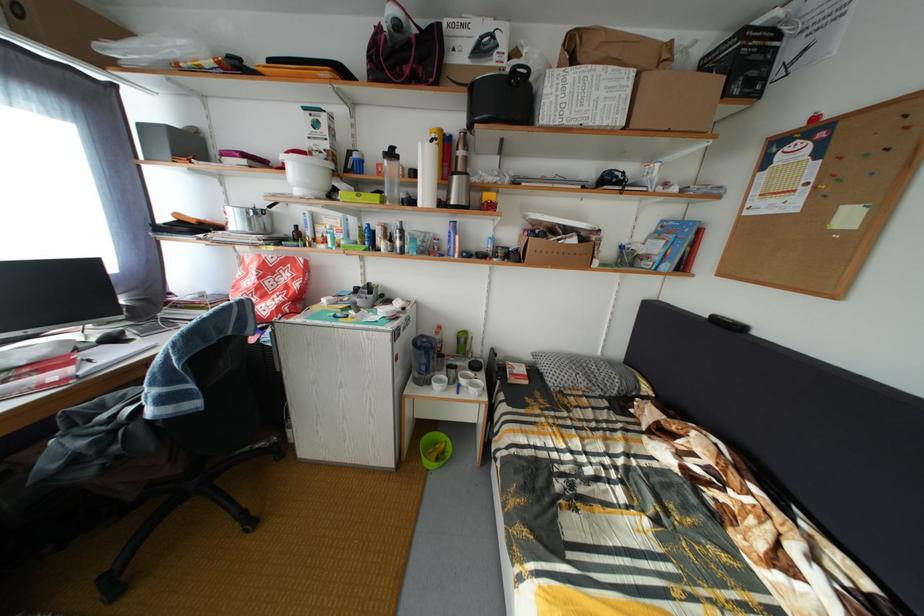
Where would you lift the black pot handle? Please return your answer as a coordinate pair (x, y).

(518, 71)